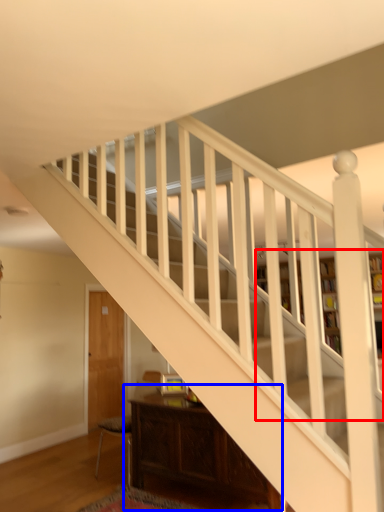
Question: Which point is further to the camera, bookcase (highlighted by a red box) or table (highlighted by a blue box)?

Choices:
 (A) bookcase
 (B) table

Answer: (A)